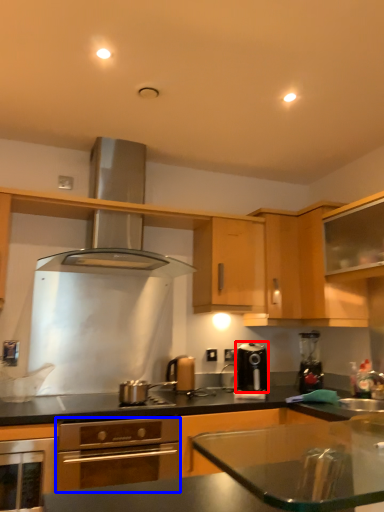
Question: Which of the following is the closest to the observer, kitchen appliance (highlighted by a red box) or kitchen appliance (highlighted by a blue box)?

Choices:
 (A) kitchen appliance
 (B) kitchen appliance

Answer: (B)